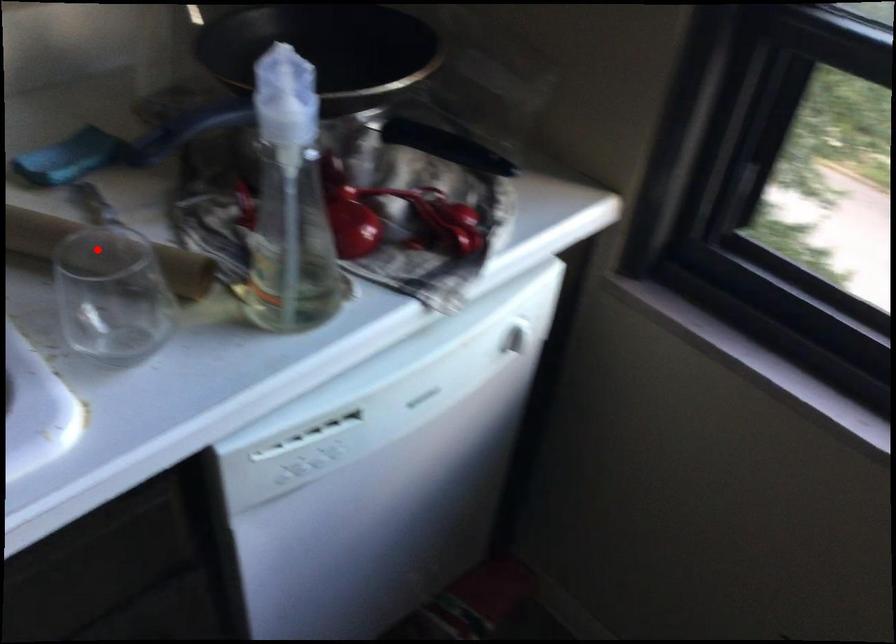
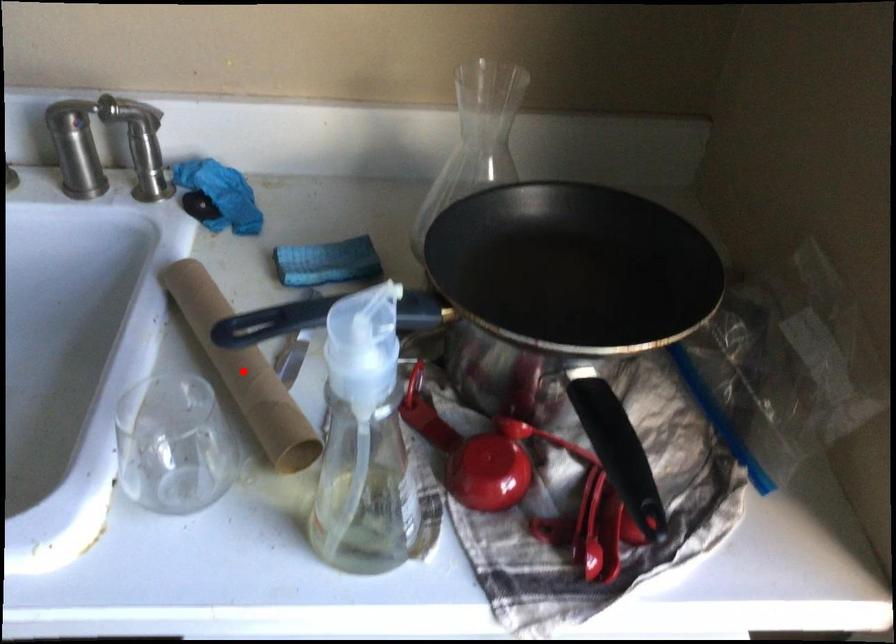
I am providing you with two images of the same scene from different viewpoints. A red point is marked on the first image and another point is marked on the second image. Is the marked point in image1 the same physical position as the marked point in image2?

Yes